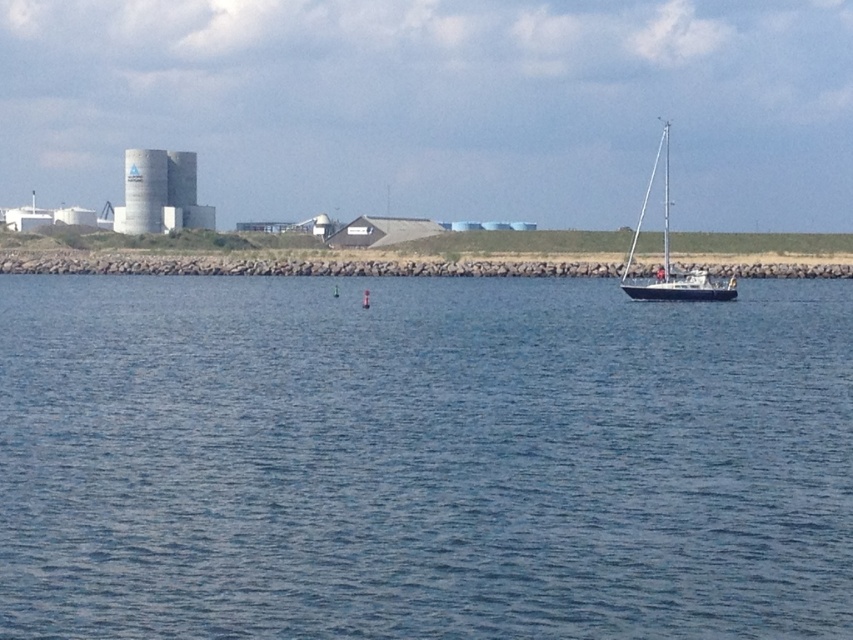
You are a photographer trying to capture the entire white concrete silo at left and blue water at center in one frame. Given that your camera has a fixed field of view, which object would require you to stand closer to ensure it fits entirely within the photo?

The blue water at center is wider than the white concrete silo at left, so to capture the entire white concrete silo at left in the photo, you would need to stand closer to it compared to the blue water at center.

You are standing at the edge of the coastal scene and want to determine which of the two points, point (549, 285) or point (564, 268), is closer to you. Based on the scene description, which point is nearer?

Point (549, 285) is closer to the viewer than point (564, 268).